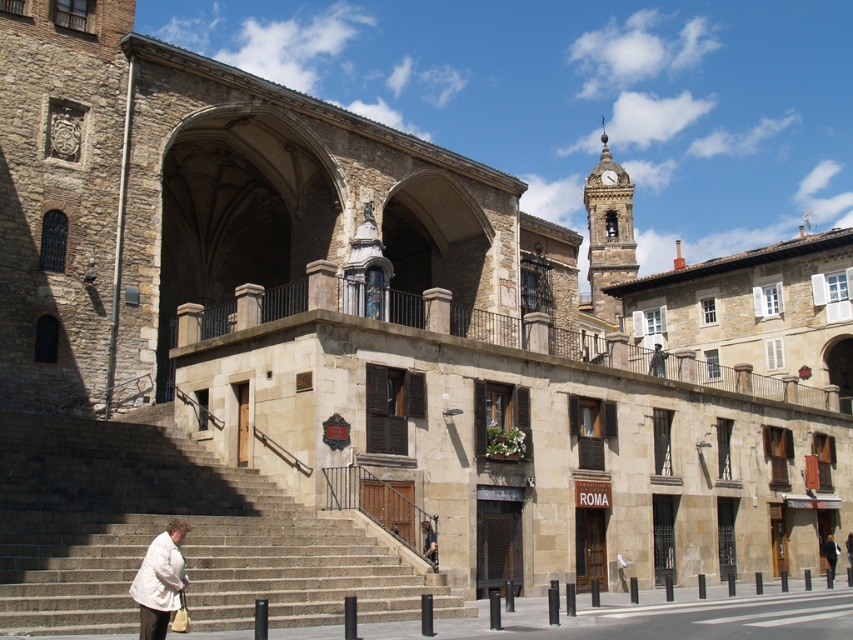
Who is shorter, white matte jacket at lower left or dark brown leather jacket at lower center?

dark brown leather jacket at lower center is shorter.

The image size is (853, 640). I want to click on white matte jacket at lower left, so click(x=160, y=580).

Does point (161, 545) come farther from viewer compared to point (421, 524)?

No, (161, 545) is closer to viewer.

Find the location of a particular element. white matte jacket at lower left is located at coordinates (160, 580).

Between point (49, 540) and point (827, 540), which one is positioned behind?

The point (827, 540) is more distant.

Who is shorter, stone stairs at center or light beige coat at lower center?

Standing shorter between the two is light beige coat at lower center.

Is point (262, 556) closer to viewer compared to point (833, 548)?

That is True.

This screenshot has height=640, width=853. I want to click on stone stairs at center, so click(x=184, y=540).

Between light beige coat at lower center and dark gray jacket at lower right, which one has more height?

dark gray jacket at lower right is taller.

Is point (833, 557) more distant than point (848, 532)?

No, (833, 557) is in front of (848, 532).

In order to click on light beige coat at lower center in this screenshot , I will do `click(830, 552)`.